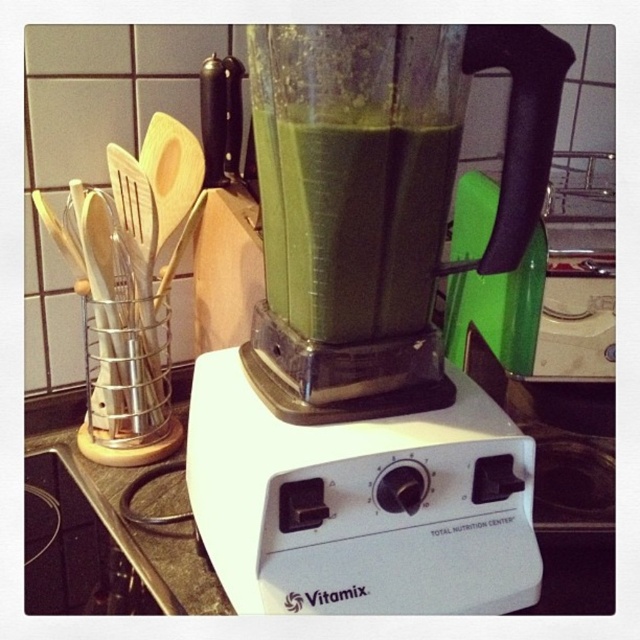
Which is in front, point (397, 208) or point (609, 483)?

Point (397, 208) is in front.

Measure the distance between green smoothie at center and white plastic countertop at center.

A distance of 13.08 inches exists between green smoothie at center and white plastic countertop at center.

Locate an element on the screen. The image size is (640, 640). green smoothie at center is located at coordinates (362, 225).

The image size is (640, 640). In order to click on green smoothie at center in this screenshot , I will do `click(362, 225)`.

Which is behind, point (301, 573) or point (609, 593)?

Point (609, 593)

Is translucent plastic blender at center behind white plastic countertop at center?

No, translucent plastic blender at center is in front of white plastic countertop at center.

I want to click on translucent plastic blender at center, so click(371, 333).

Who is positioned more to the left, translucent plastic blender at center or green smoothie at center?

Positioned to the left is green smoothie at center.

Between translucent plastic blender at center and green smoothie at center, which one is positioned lower?

translucent plastic blender at center

Where is `translucent plastic blender at center`? translucent plastic blender at center is located at coordinates (371, 333).